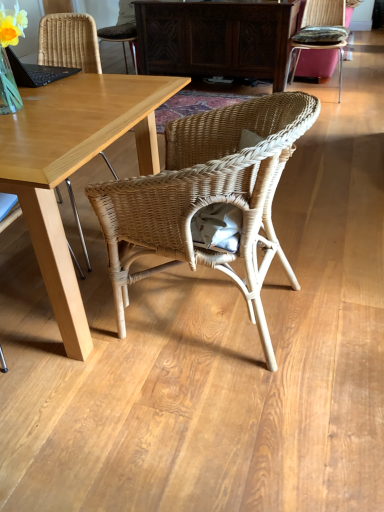
The width and height of the screenshot is (384, 512). What are the coordinates of `woven wicker chair at center, which is the 2th chair from front to back` in the screenshot? It's located at (69, 42).

Is light wood desk at center oriented away from dark wood cabinet at center?

No, light wood desk at center is not facing away from dark wood cabinet at center.

Which of these two, light wood desk at center or dark wood cabinet at center, is bigger?

With larger size is light wood desk at center.

Is the surface of light wood desk at center in direct contact with dark wood cabinet at center?

There is a gap between light wood desk at center and dark wood cabinet at center.

Can we say light wood desk at center lies outside dark wood cabinet at center?

light wood desk at center is positioned outside dark wood cabinet at center.

Considering the relative positions of natural wicker chair at center, the second chair positioned from the right, and light wood desk at center in the image provided, is natural wicker chair at center, the second chair positioned from the right, to the left of light wood desk at center from the viewer's perspective?

No.

Which object is thinner, natural wicker chair at center, which is the third chair from back to front, or light wood desk at center?

With smaller width is natural wicker chair at center, which is the third chair from back to front.

Are natural wicker chair at center, arranged as the 2th chair when viewed from the left, and light wood desk at center far apart?

That's not correct — natural wicker chair at center, arranged as the 2th chair when viewed from the left, is a little close to light wood desk at center.

From the picture: Does natural wicker chair at center, which is counted as the 3th chair, starting from the top, have a greater height compared to light wood desk at center?

Yes, natural wicker chair at center, which is counted as the 3th chair, starting from the top, is taller than light wood desk at center.

Is dark wood cabinet at center shorter than rattan cushion at upper right, the 3th chair viewed from the front?

Yes, dark wood cabinet at center is shorter than rattan cushion at upper right, the 3th chair viewed from the front.

Which of these two, dark wood cabinet at center or rattan cushion at upper right, which appears as the 1th chair when viewed from the back, is bigger?

dark wood cabinet at center.

Which object is more forward, dark wood cabinet at center or rattan cushion at upper right, acting as the third chair starting from the bottom?

rattan cushion at upper right, acting as the third chair starting from the bottom.

Does dark wood cabinet at center appear on the right side of rattan cushion at upper right, which is the 1th chair from right to left?

In fact, dark wood cabinet at center is to the left of rattan cushion at upper right, which is the 1th chair from right to left.

Identify the location of the 2nd chair located beneath the dark wood cabinet at center (from a real-world perspective). (207, 197).

In the scene shown: Considering the sizes of objects natural wicker chair at center, which is counted as the 1th chair, starting from the bottom, and dark wood cabinet at center in the image provided, who is thinner, natural wicker chair at center, which is counted as the 1th chair, starting from the bottom, or dark wood cabinet at center?

dark wood cabinet at center.

From a real-world perspective, is natural wicker chair at center, which is the third chair from back to front, located beneath dark wood cabinet at center?

Correct, in the physical world, natural wicker chair at center, which is the third chair from back to front, is lower than dark wood cabinet at center.

Does natural wicker chair at center, the second chair positioned from the right, have a lesser height compared to dark wood cabinet at center?

In fact, natural wicker chair at center, the second chair positioned from the right, may be taller than dark wood cabinet at center.

Which object is positioned more to the right, rattan cushion at upper right, which is the first chair from top to bottom, or woven wicker chair at center, the second chair viewed from the top?

From the viewer's perspective, rattan cushion at upper right, which is the first chair from top to bottom, appears more on the right side.

Does rattan cushion at upper right, acting as the third chair starting from the bottom, have a greater height compared to woven wicker chair at center, the 2th chair ordered from the bottom?

Incorrect, the height of rattan cushion at upper right, acting as the third chair starting from the bottom, is not larger of that of woven wicker chair at center, the 2th chair ordered from the bottom.

Which of these two, rattan cushion at upper right, which is the first chair from top to bottom, or woven wicker chair at center, the 1th chair positioned from the left, is smaller?

Smaller between the two is rattan cushion at upper right, which is the first chair from top to bottom.

From a real-world perspective, between rattan cushion at upper right, the 3th chair viewed from the front, and woven wicker chair at center, the 2th chair ordered from the bottom, who is vertically higher?

In real-world perspective, woven wicker chair at center, the 2th chair ordered from the bottom, is above.

Between natural wicker chair at center, which is counted as the 1th chair, starting from the bottom, and woven wicker chair at center, which is the 2th chair from front to back, which one is positioned in front?

natural wicker chair at center, which is counted as the 1th chair, starting from the bottom, is in front.

Which is less distant, (176, 179) or (73, 53)?

The point (176, 179) is more forward.

Is natural wicker chair at center, which is the 1th chair from front to back, oriented away from woven wicker chair at center, the 2th chair ordered from the bottom?

No.

Considering the relative sizes of natural wicker chair at center, which is counted as the 1th chair, starting from the bottom, and woven wicker chair at center, which ranks as the 2th chair in back-to-front order, in the image provided, is natural wicker chair at center, which is counted as the 1th chair, starting from the bottom, shorter than woven wicker chair at center, which ranks as the 2th chair in back-to-front order,?

Yes.

Is light wood desk at center beside rattan cushion at upper right, which is the 1th chair from right to left?

No, light wood desk at center is not beside rattan cushion at upper right, which is the 1th chair from right to left.

Considering the relative sizes of light wood desk at center and rattan cushion at upper right, which is the 1th chair from right to left, in the image provided, is light wood desk at center smaller than rattan cushion at upper right, which is the 1th chair from right to left,?

Actually, light wood desk at center might be larger than rattan cushion at upper right, which is the 1th chair from right to left.

In the scene shown: Could you tell me if light wood desk at center is facing rattan cushion at upper right, the 3th chair viewed from the front?

Yes.

In the image, is light wood desk at center on the left side or the right side of rattan cushion at upper right, which appears as the 1th chair when viewed from the back?

From the image, it's evident that light wood desk at center is to the left of rattan cushion at upper right, which appears as the 1th chair when viewed from the back.

Locate an element on the screen. desk on the left of dark wood cabinet at center is located at coordinates (73, 167).

Identify the location of chair that is the 1st object above the light wood desk at center (from a real-world perspective). Image resolution: width=384 pixels, height=512 pixels. (207, 197).

From the image, which object appears to be farther from natural wicker chair at center, which is the 1th chair from front to back, rattan cushion at upper right, arranged as the 3th chair when viewed from the left, or light wood desk at center?

The object further to natural wicker chair at center, which is the 1th chair from front to back, is rattan cushion at upper right, arranged as the 3th chair when viewed from the left.

Based on the photo, based on their spatial positions, is rattan cushion at upper right, which is the 1th chair from right to left, or light wood desk at center further from dark wood cabinet at center?

Among the two, light wood desk at center is located further to dark wood cabinet at center.

When comparing their distances from dark wood cabinet at center, does rattan cushion at upper right, arranged as the 3th chair when viewed from the left, or natural wicker chair at center, which is the third chair from back to front, seem further?

The object further to dark wood cabinet at center is natural wicker chair at center, which is the third chair from back to front.

Which object lies further to the anchor point rattan cushion at upper right, arranged as the 3th chair when viewed from the left, dark wood cabinet at center or natural wicker chair at center, which is the 1th chair from front to back?

The object further to rattan cushion at upper right, arranged as the 3th chair when viewed from the left, is natural wicker chair at center, which is the 1th chair from front to back.

Consider the image. Based on their spatial positions, is dark wood cabinet at center or rattan cushion at upper right, arranged as the 3th chair when viewed from the left, closer to natural wicker chair at center, which is the 1th chair from front to back?

The object closer to natural wicker chair at center, which is the 1th chair from front to back, is dark wood cabinet at center.

Estimate the real-world distances between objects in this image. Which object is further from rattan cushion at upper right, arranged as the 3th chair when viewed from the left, woven wicker chair at center, which ranks as the 2th chair in back-to-front order, or natural wicker chair at center, which is counted as the 3th chair, starting from the top?

natural wicker chair at center, which is counted as the 3th chair, starting from the top, is further to rattan cushion at upper right, arranged as the 3th chair when viewed from the left.

Estimate the real-world distances between objects in this image. Which object is closer to dark wood cabinet at center, natural wicker chair at center, which is counted as the 3th chair, starting from the top, or rattan cushion at upper right, arranged as the 3th chair when viewed from the left?

The object closer to dark wood cabinet at center is rattan cushion at upper right, arranged as the 3th chair when viewed from the left.

Looking at the image, which one is located further to light wood desk at center, natural wicker chair at center, which is the third chair from back to front, or rattan cushion at upper right, acting as the third chair starting from the bottom?

rattan cushion at upper right, acting as the third chair starting from the bottom, is positioned further to the anchor light wood desk at center.

Identify the location of chair positioned between light wood desk at center and rattan cushion at upper right, which is the first chair from top to bottom, from near to far. pos(69,42).

Image resolution: width=384 pixels, height=512 pixels. Identify the location of chair between light wood desk at center and natural wicker chair at center, which is the third chair from back to front, in the horizontal direction. (69, 42).

This screenshot has width=384, height=512. What are the coordinates of `chair between woven wicker chair at center, which ranks as the 3th chair in right-to-left order, and dark wood cabinet at center in the front-back direction` in the screenshot? It's located at (319, 33).

Identify the location of desk located between natural wicker chair at center, which is the third chair from back to front, and dark wood cabinet at center in the depth direction. (73, 167).